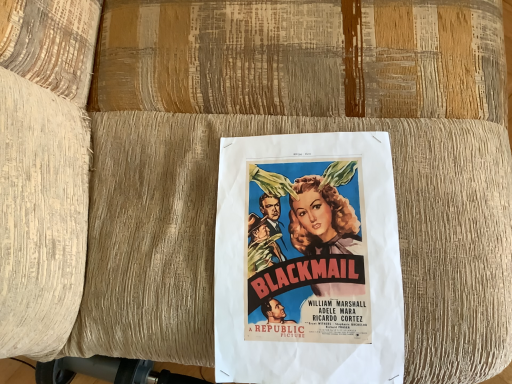
Find the location of `empty space that is ontop of matte paper poster at center (from a real-world perspective)`. empty space that is ontop of matte paper poster at center (from a real-world perspective) is located at coordinates (310, 255).